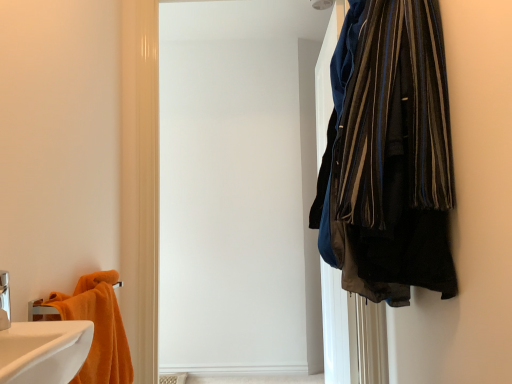
Question: Is white matte screen door at upper right smaller than white glossy sink at lower left?

Choices:
 (A) yes
 (B) no

Answer: (B)

Question: Does white matte screen door at upper right appear on the right side of white glossy sink at lower left?

Choices:
 (A) yes
 (B) no

Answer: (A)

Question: Is white matte screen door at upper right further to camera compared to white glossy sink at lower left?

Choices:
 (A) yes
 (B) no

Answer: (A)

Question: Does white matte screen door at upper right have a larger size compared to white glossy sink at lower left?

Choices:
 (A) no
 (B) yes

Answer: (B)

Question: Is white matte screen door at upper right not inside white glossy sink at lower left?

Choices:
 (A) yes
 (B) no

Answer: (A)

Question: From a real-world perspective, is white glossy sink at lower left physically located above or below white matte screen door at upper right?

Choices:
 (A) below
 (B) above

Answer: (A)

Question: Is white glossy sink at lower left bigger or smaller than white matte screen door at upper right?

Choices:
 (A) small
 (B) big

Answer: (A)

Question: Considering the positions of point pyautogui.click(x=79, y=327) and point pyautogui.click(x=195, y=172), is point pyautogui.click(x=79, y=327) closer or farther from the camera than point pyautogui.click(x=195, y=172)?

Choices:
 (A) closer
 (B) farther

Answer: (A)

Question: Is white glossy sink at lower left taller or shorter than white matte screen door at upper right?

Choices:
 (A) tall
 (B) short

Answer: (B)

Question: Considering the positions of white matte screen door at upper right and orange cotton towel at lower left in the image, is white matte screen door at upper right taller or shorter than orange cotton towel at lower left?

Choices:
 (A) tall
 (B) short

Answer: (A)

Question: In terms of width, does white matte screen door at upper right look wider or thinner when compared to orange cotton towel at lower left?

Choices:
 (A) thin
 (B) wide

Answer: (A)

Question: From the image's perspective, is white matte screen door at upper right located above or below orange cotton towel at lower left?

Choices:
 (A) above
 (B) below

Answer: (A)

Question: Would you say white matte screen door at upper right is to the left or to the right of orange cotton towel at lower left in the picture?

Choices:
 (A) left
 (B) right

Answer: (B)

Question: Would you say white glossy sink at lower left is to the left or to the right of orange cotton towel at lower left in the picture?

Choices:
 (A) right
 (B) left

Answer: (A)

Question: In terms of height, does white glossy sink at lower left look taller or shorter compared to orange cotton towel at lower left?

Choices:
 (A) short
 (B) tall

Answer: (A)